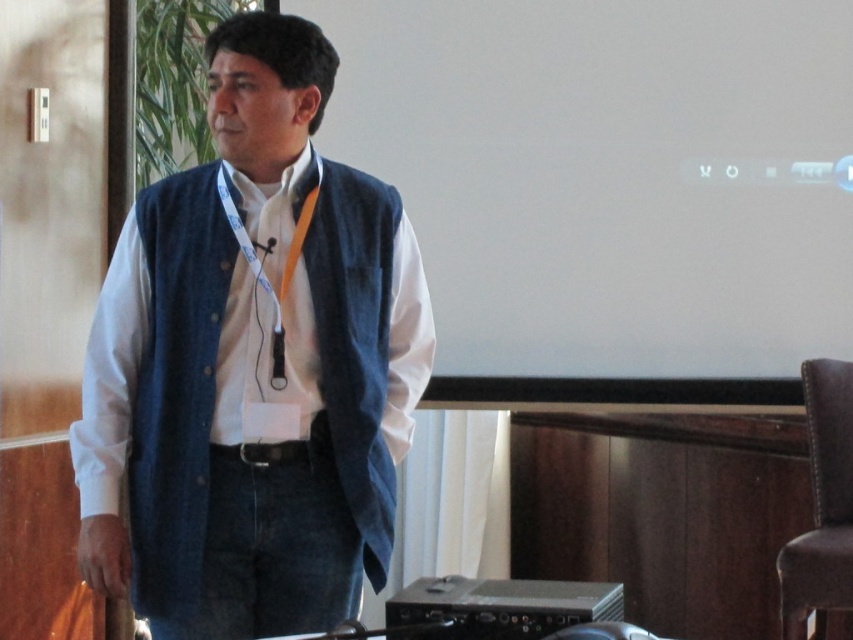
Question: Can you confirm if white matte projection screen at upper center is positioned to the right of denim vest at center?

Choices:
 (A) no
 (B) yes

Answer: (B)

Question: Where is white matte projection screen at upper center located in relation to denim vest at center in the image?

Choices:
 (A) below
 (B) above

Answer: (B)

Question: Which object is closer to the camera taking this photo?

Choices:
 (A) denim vest at center
 (B) white matte projection screen at upper center

Answer: (A)

Question: Which point is closer to the camera?

Choices:
 (A) white matte projection screen at upper center
 (B) denim vest at center

Answer: (B)

Question: Is white matte projection screen at upper center smaller than denim vest at center?

Choices:
 (A) no
 (B) yes

Answer: (B)